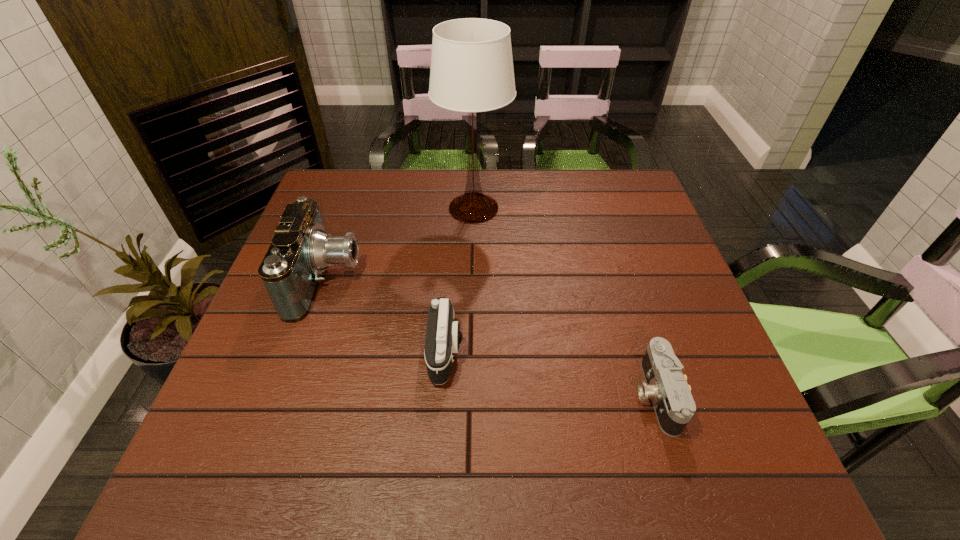
Identify the location of free space located 0.080m on the front lens of the second shortest object. (500, 352).

Locate an element on the screen. free space located on the lens of the rightmost object is located at coordinates (595, 395).

I want to click on vacant position located on the lens of the rightmost object, so click(524, 395).

Locate an element on the screen. vacant space located on the lens of the rightmost object is located at coordinates [580, 395].

Image resolution: width=960 pixels, height=540 pixels. I want to click on object that is at the far edge, so click(471, 71).

Identify the location of object that is at the left edge. (291, 270).

This screenshot has width=960, height=540. Find the location of `object located at the right edge`. object located at the right edge is located at coordinates (666, 386).

In the image, there is a desktop. At what (x,y) coordinates should I click in order to perform the action: click on free region at the far edge. Please return your answer as a coordinate pair (x, y). The height and width of the screenshot is (540, 960). Looking at the image, I should click on (434, 179).

This screenshot has height=540, width=960. Find the location of `blank area at the near edge`. blank area at the near edge is located at coordinates (321, 474).

The height and width of the screenshot is (540, 960). In the image, there is a desktop. Find the location of `vacant space at the left edge`. vacant space at the left edge is located at coordinates (308, 345).